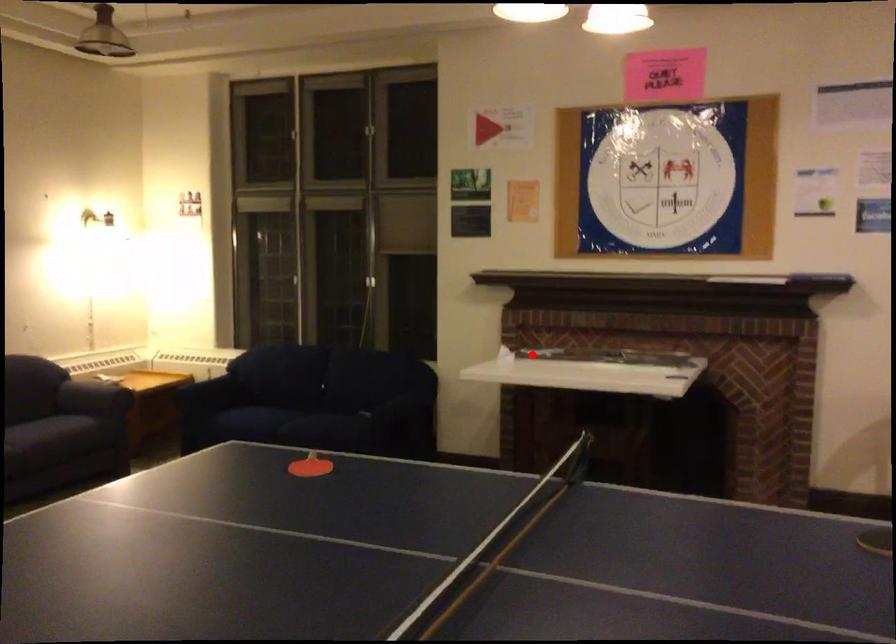
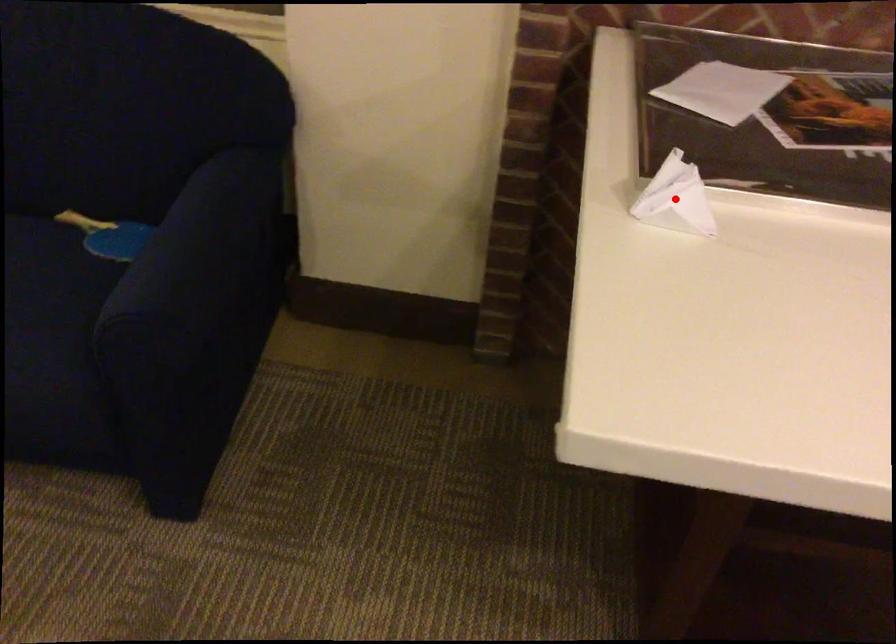
I am providing you with two images of the same scene from different viewpoints. A red point is marked on the first image and another point is marked on the second image. Is the marked point in image1 the same physical position as the marked point in image2?

Yes